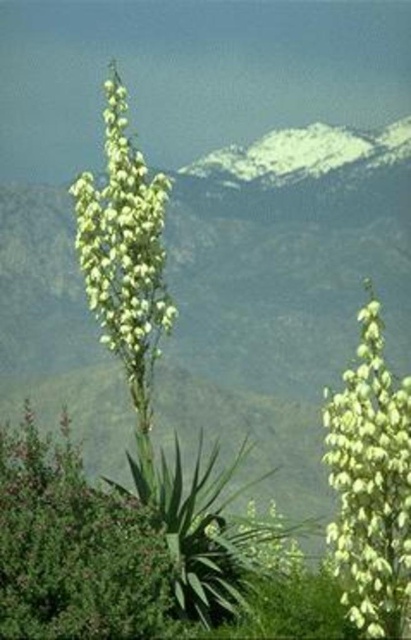
Is point (4, 497) positioned after point (110, 189)?

No, it is in front of (110, 189).

Consider the image. Can you confirm if green leafy bush at center is shorter than green leafy plant at center?

Yes, green leafy bush at center is shorter than green leafy plant at center.

Where is `green leafy bush at center`? green leafy bush at center is located at coordinates (73, 548).

Does point (6, 497) lie in front of point (367, 342)?

No, (6, 497) is behind (367, 342).

You are a GUI agent. You are given a task and a screenshot of the screen. Output one action in this format:
    pyautogui.click(x=<x>, y=<y>)
    Task: Click on the green leafy bush at center
    The image size is (411, 640).
    Given the screenshot: What is the action you would take?
    pyautogui.click(x=73, y=548)

Is point (371, 499) positioned in front of point (127, 144)?

Yes, it is.

Find the location of a particular element. This screenshot has width=411, height=640. white matte flower at right is located at coordinates (371, 484).